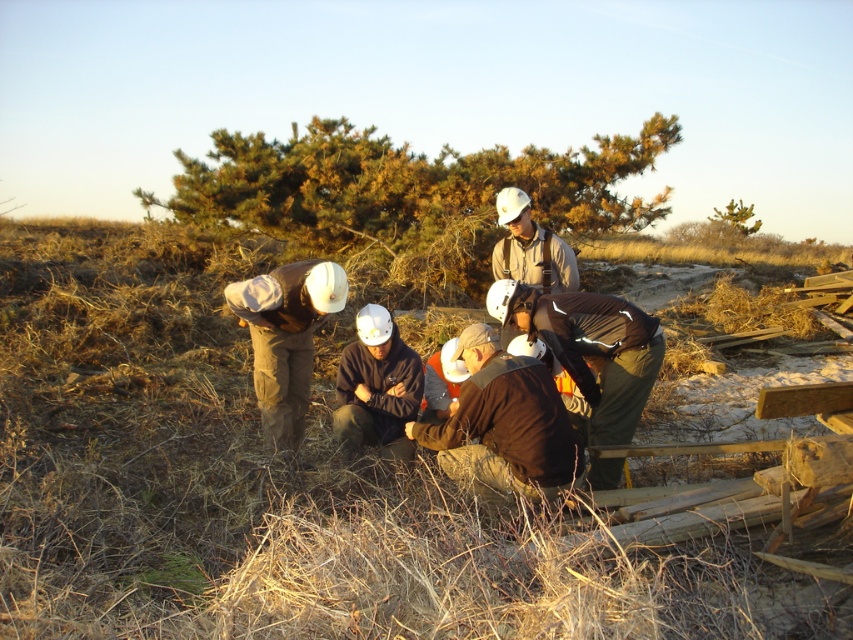
Describe the element at coordinates (274, 488) in the screenshot. The height and width of the screenshot is (640, 853). I see `brown fabric at center` at that location.

From the picture: Can you confirm if brown fabric at center is shorter than brown fabric jacket at center?

Incorrect, brown fabric at center's height does not fall short of brown fabric jacket at center's.

Does point (276, 596) come behind point (473, 452)?

No.

Where is `brown fabric at center`? The image size is (853, 640). brown fabric at center is located at coordinates (274, 488).

Does brown fabric jacket at center have a smaller size compared to dark brown jacket at center?

No, brown fabric jacket at center is not smaller than dark brown jacket at center.

Is point (480, 492) more distant than point (379, 410)?

No, (480, 492) is in front of (379, 410).

Locate an element on the screen. The height and width of the screenshot is (640, 853). brown fabric jacket at center is located at coordinates (503, 426).

I want to click on brown fabric jacket at center, so click(503, 426).

Looking at this image, which of these two, dark brown leather jacket at lower center or dark brown jacket at center, stands taller?

With more height is dark brown leather jacket at lower center.

Between dark brown leather jacket at lower center and dark brown jacket at center, which one is positioned higher?

dark brown leather jacket at lower center is higher up.

I want to click on dark brown leather jacket at lower center, so click(x=590, y=348).